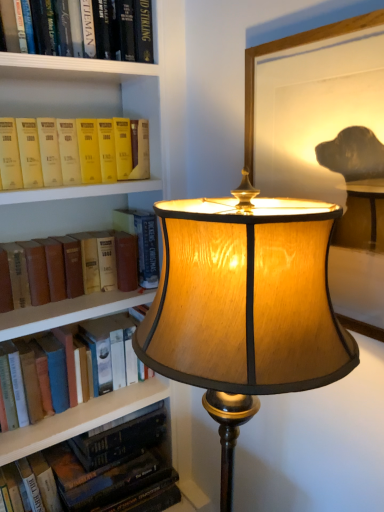
Question: Is hardcover book at center, the 2th book in the top-to-bottom sequence, bigger or smaller than wooden lampshade at center?

Choices:
 (A) small
 (B) big

Answer: (A)

Question: Relative to wooden lampshade at center, is hardcover book at center, the 2th book in the top-to-bottom sequence, in front or behind?

Choices:
 (A) behind
 (B) front

Answer: (A)

Question: Which object is the closest to the wooden lampshade at center?

Choices:
 (A) brown leather book at left, which is counted as the 3th book, starting from the top
 (B) hardcover book at lower left, which is the fifth book from top to bottom
 (C) hardcover book at left, placed as the 4th book when sorted from top to bottom
 (D) matte yellow book at left, the 5th book from the bottom
 (E) wooden picture frame at upper right

Answer: (E)

Question: Considering the real-world distances, which object is farthest from the wooden picture frame at upper right?

Choices:
 (A) hardcover book at lower left, which is the fifth book from top to bottom
 (B) brown leather book at left, which is counted as the 3th book, starting from the top
 (C) matte yellow book at left, the 5th book from the bottom
 (D) hardcover book at left, placed as the 4th book when sorted from top to bottom
 (E) wooden lampshade at center

Answer: (A)